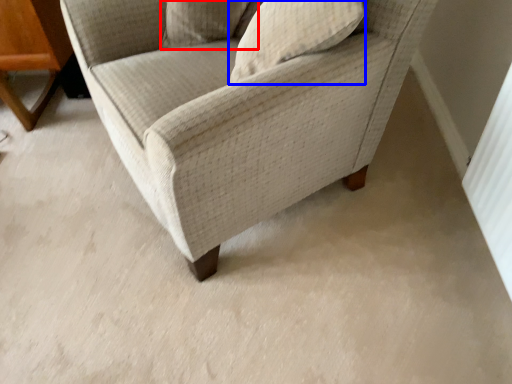
Question: Which point is further to the camera, pillow (highlighted by a red box) or pillow (highlighted by a blue box)?

Choices:
 (A) pillow
 (B) pillow

Answer: (A)